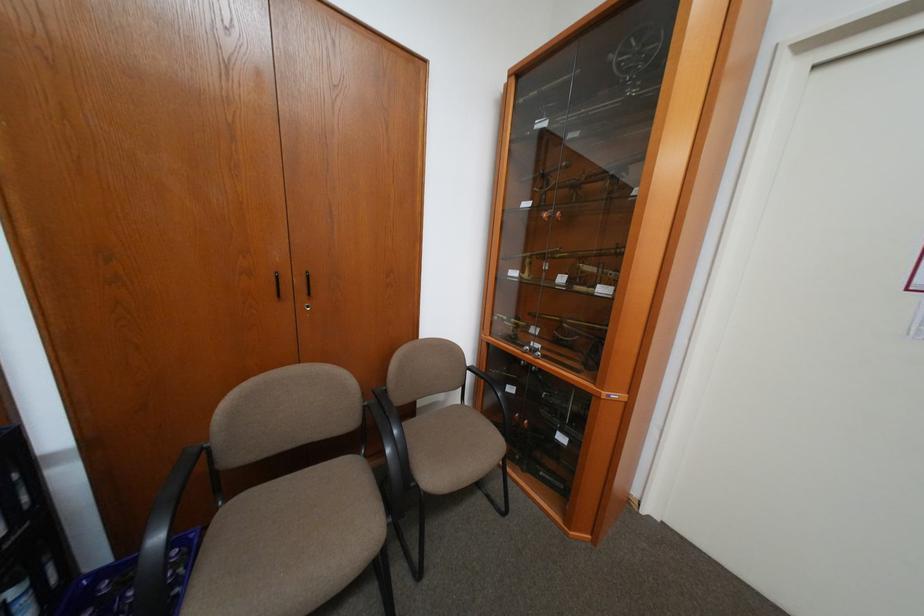
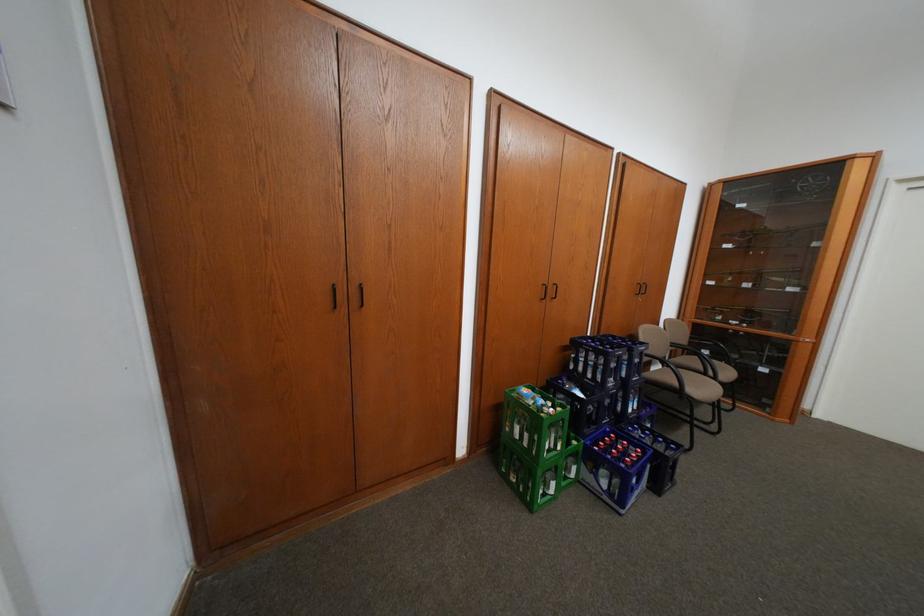
In a continuous first-person perspective shot, in which direction is the camera moving?

The cameraman walked toward left, backward.